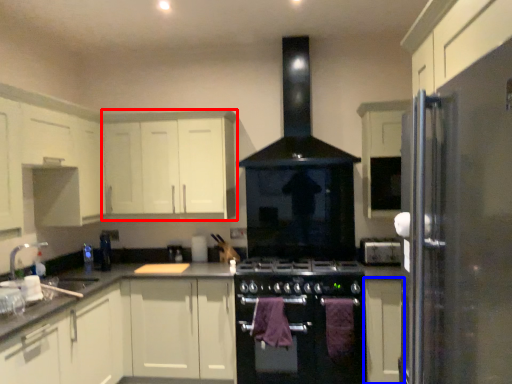
Question: Which of the following is the closest to the observer, cabinetry (highlighted by a red box) or cabinetry (highlighted by a blue box)?

Choices:
 (A) cabinetry
 (B) cabinetry

Answer: (B)